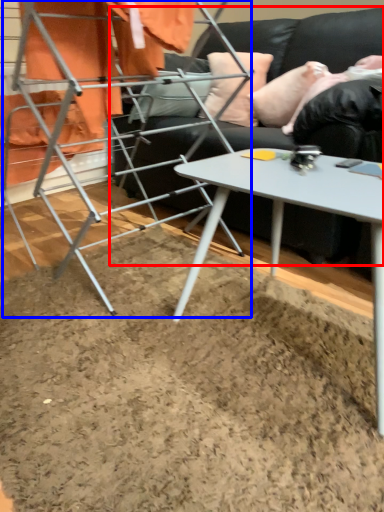
Question: Which of the following is the closest to the observer, studio couch (highlighted by a red box) or bunk bed (highlighted by a blue box)?

Choices:
 (A) studio couch
 (B) bunk bed

Answer: (B)